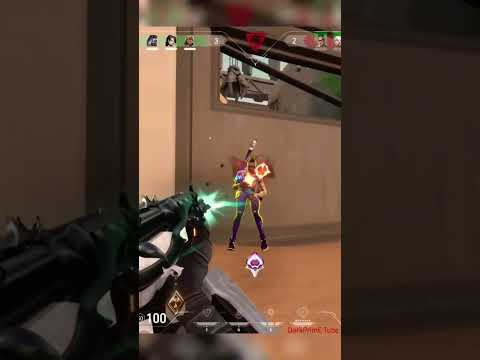
Find the location of `1 material used for floor`. 1 material used for floor is located at coordinates (304, 273).